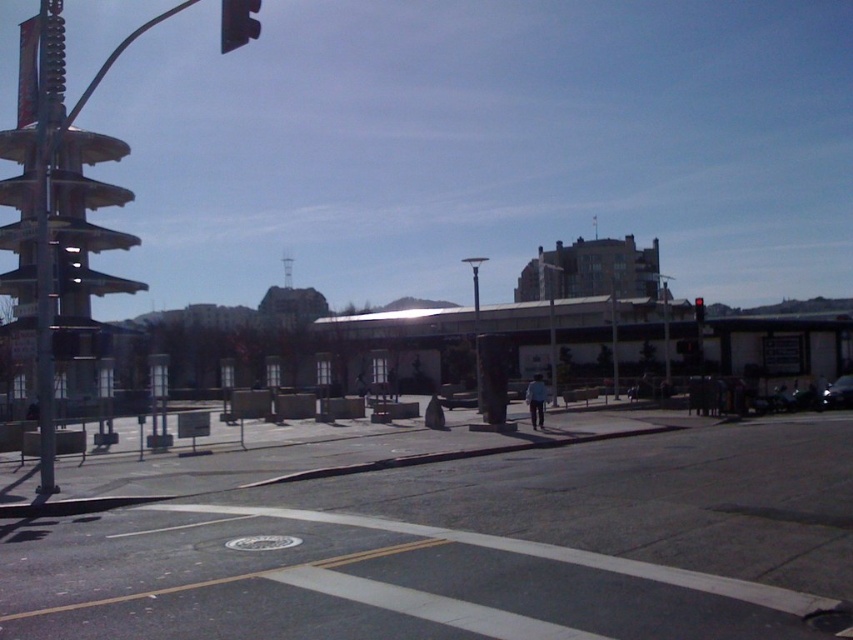
Question: Which point is closer to the camera?

Choices:
 (A) (828, 388)
 (B) (695, 305)
 (C) (236, 3)
 (D) (47, 326)

Answer: (C)

Question: Is metallic pole at left above black plastic traffic light at upper left?

Choices:
 (A) yes
 (B) no

Answer: (B)

Question: Does metallic pole at left appear on the left side of red matte traffic light at center?

Choices:
 (A) no
 (B) yes

Answer: (B)

Question: Which point appears closest to the camera in this image?

Choices:
 (A) [x=59, y=102]
 (B) [x=241, y=26]
 (C) [x=701, y=316]
 (D) [x=851, y=374]

Answer: (B)

Question: Can you confirm if black plastic traffic light at upper left is thinner than red matte traffic light at center?

Choices:
 (A) yes
 (B) no

Answer: (A)

Question: Estimate the real-world distances between objects in this image. Which object is closer to the red matte traffic light at center?

Choices:
 (A) black plastic traffic light at upper left
 (B) shiny black car at lower right

Answer: (B)